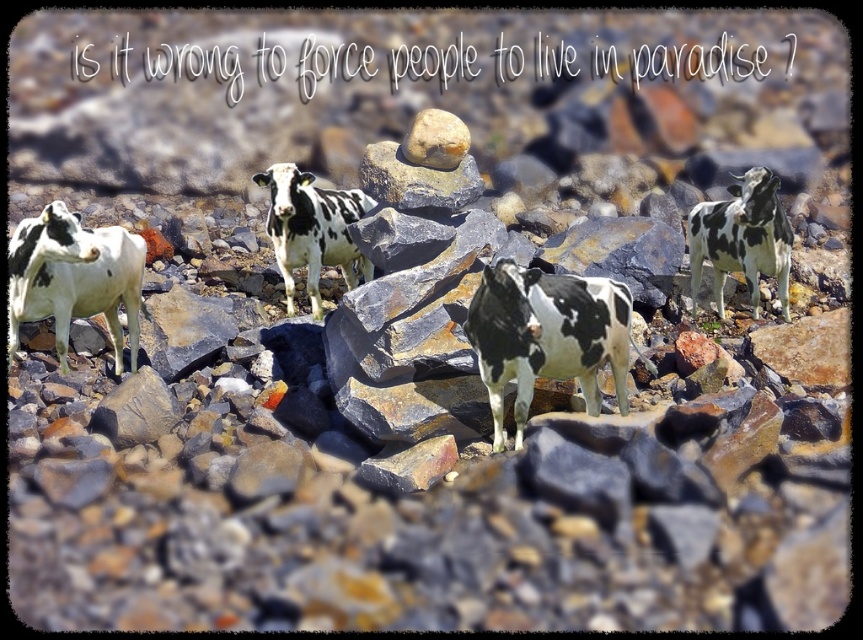
Between black-and-white cow at center and white and black spotted cow at left, which one appears on the right side from the viewer's perspective?

black-and-white cow at center is more to the right.

Can you confirm if black-and-white cow at center is thinner than white and black spotted cow at left?

In fact, black-and-white cow at center might be wider than white and black spotted cow at left.

Image resolution: width=863 pixels, height=640 pixels. I want to click on black-and-white cow at center, so click(546, 336).

Is point (715, 282) less distant than point (329, 244)?

That is False.

Can you confirm if black-and-white spotted cow at upper right is wider than black and white spotted cow at center?

Correct, the width of black-and-white spotted cow at upper right exceeds that of black and white spotted cow at center.

Where is `black-and-white spotted cow at upper right`? The width and height of the screenshot is (863, 640). black-and-white spotted cow at upper right is located at coordinates (741, 240).

Identify the location of black-and-white spotted cow at upper right. (741, 240).

Between white and black spotted cow at left and black-and-white spotted cow at upper right, which one has less height?

A: white and black spotted cow at left

Between white and black spotted cow at left and black-and-white spotted cow at upper right, which one is positioned lower?

white and black spotted cow at left

Does point (51, 241) come behind point (731, 250)?

That is False.

The height and width of the screenshot is (640, 863). Identify the location of white and black spotted cow at left. (74, 278).